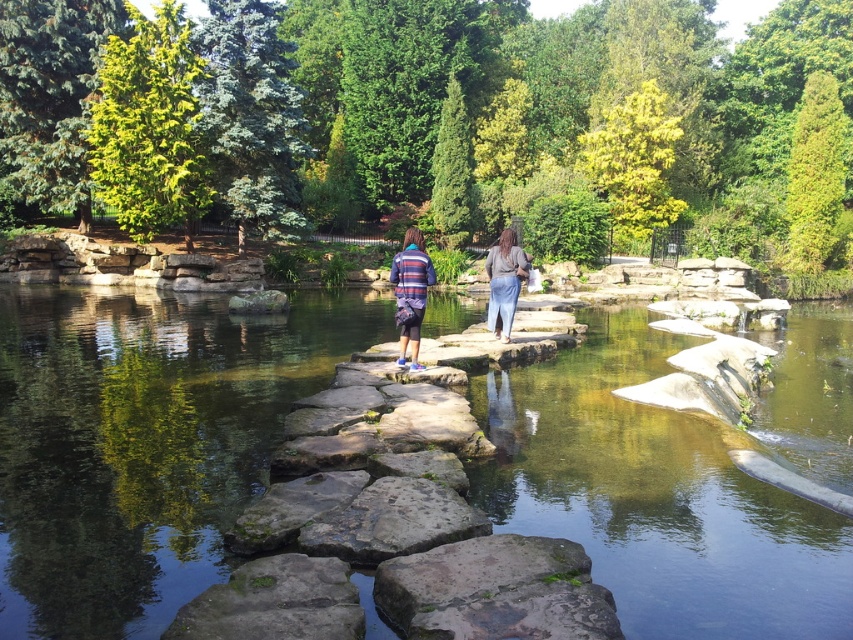
Question: Which point appears farthest from the camera in this image?

Choices:
 (A) (413, 312)
 (B) (404, 257)

Answer: (B)

Question: In this image, where is striped sweater at center located relative to denim pants at center?

Choices:
 (A) left
 (B) right

Answer: (A)

Question: Which object is closer to the camera taking this photo?

Choices:
 (A) striped sweater at center
 (B) striped fabric jacket at center
 (C) clear stone pond at center
 (D) denim pants at center

Answer: (C)

Question: Does clear stone pond at center appear on the left side of striped fabric jacket at center?

Choices:
 (A) yes
 (B) no

Answer: (A)

Question: Based on their relative distances, which object is farther from the denim pants at center?

Choices:
 (A) striped fabric jacket at center
 (B) striped sweater at center

Answer: (B)

Question: Considering the relative positions of striped sweater at center and denim pants at center in the image provided, where is striped sweater at center located with respect to denim pants at center?

Choices:
 (A) left
 (B) right

Answer: (A)